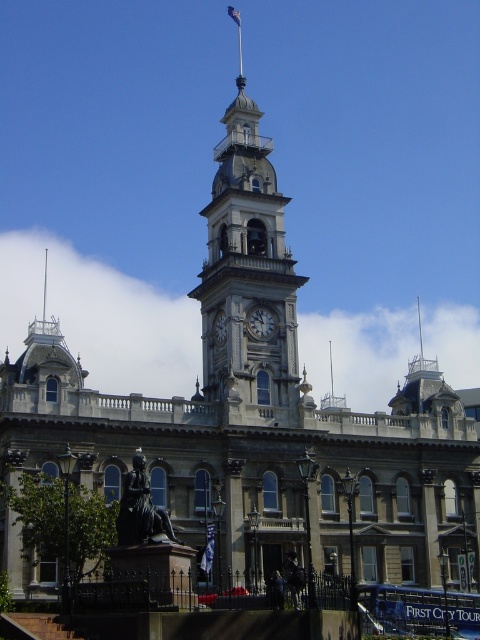
Is silver metallic clock at center below white fabric flag at top-center?

Indeed, silver metallic clock at center is positioned under white fabric flag at top-center.

Does silver metallic clock at center appear on the right side of white fabric flag at top-center?

Incorrect, silver metallic clock at center is not on the right side of white fabric flag at top-center.

Does point (224, 328) come in front of point (238, 20)?

Yes, it is.

Where is `silver metallic clock at center`? This screenshot has height=640, width=480. silver metallic clock at center is located at coordinates (219, 326).

Which is in front, point (252, 300) or point (230, 8)?

Point (252, 300) is more forward.

Consider the image. Between polished brass clock tower at center and white fabric flag at top-center, which one is positioned lower?

polished brass clock tower at center is lower down.

I want to click on polished brass clock tower at center, so click(249, 275).

Does blue fabric flag at lower center appear on the right side of silver metallic clock at center?

In fact, blue fabric flag at lower center is to the left of silver metallic clock at center.

Which is in front, point (210, 554) or point (217, 332)?

Positioned in front is point (210, 554).

Based on the photo, measure the distance between point (204, 563) and camera.

Point (204, 563) and camera are 63.91 meters apart.

Where is `blue fabric flag at lower center`? The image size is (480, 640). blue fabric flag at lower center is located at coordinates (207, 550).